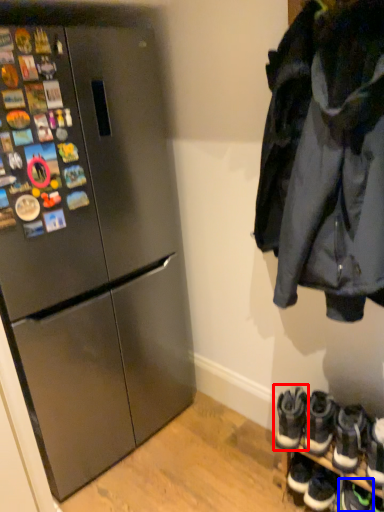
Question: Which point is closer to the camera, footwear (highlighted by a red box) or footwear (highlighted by a blue box)?

Choices:
 (A) footwear
 (B) footwear

Answer: (B)